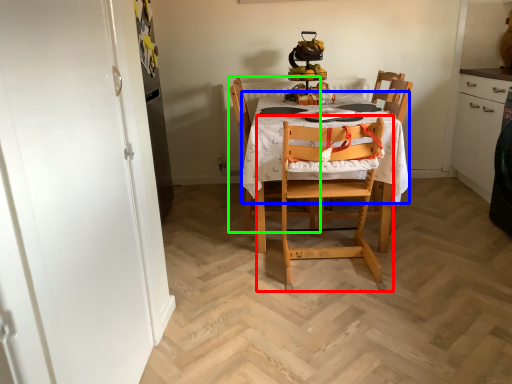
Question: Estimate the real-world distances between objects in this image. Which object is closer to chair (highlighted by a red box), tablecloth (highlighted by a blue box) or chair (highlighted by a green box)?

Choices:
 (A) tablecloth
 (B) chair

Answer: (A)